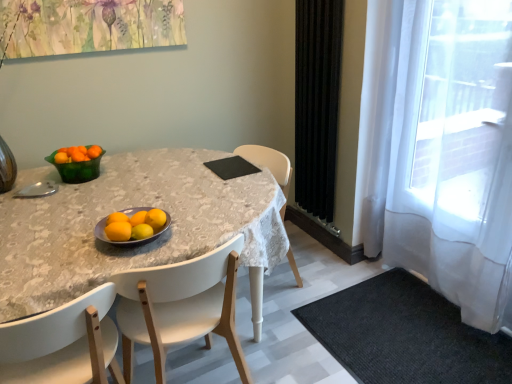
Question: Would you say black textured rug at lower right is to the left or to the right of matte gray bowl at center, arranged as the 1th bowl when ordered from the bottom, in the picture?

Choices:
 (A) right
 (B) left

Answer: (A)

Question: From the image's perspective, is black textured rug at lower right located above or below matte gray bowl at center, which ranks as the first bowl in right-to-left order?

Choices:
 (A) below
 (B) above

Answer: (A)

Question: Considering the real-world distances, which object is closest to the white glossy table at center?

Choices:
 (A) black matte pad at center
 (B) yellow matte/orange at center, which is the 2th orange from front to back
 (C) black textured rug at lower right
 (D) orange matte at center, the 4th tangerine from the top
 (E) white sheer curtain at right, acting as the 2th curtain starting from the left

Answer: (D)

Question: Which is farther from the yellow matte/orange at center, positioned as the 2th orange in back-to-front order?

Choices:
 (A) white wood chair at center, which appears as the first chair when viewed from the right
 (B) white glossy table at center
 (C) black velvet curtain at right, positioned as the first curtain in left-to-right order
 (D) orange matte at center, arranged as the third tangerine when viewed from the top
 (E) white sheer curtain at right, arranged as the 1th curtain when viewed from the right

Answer: (E)